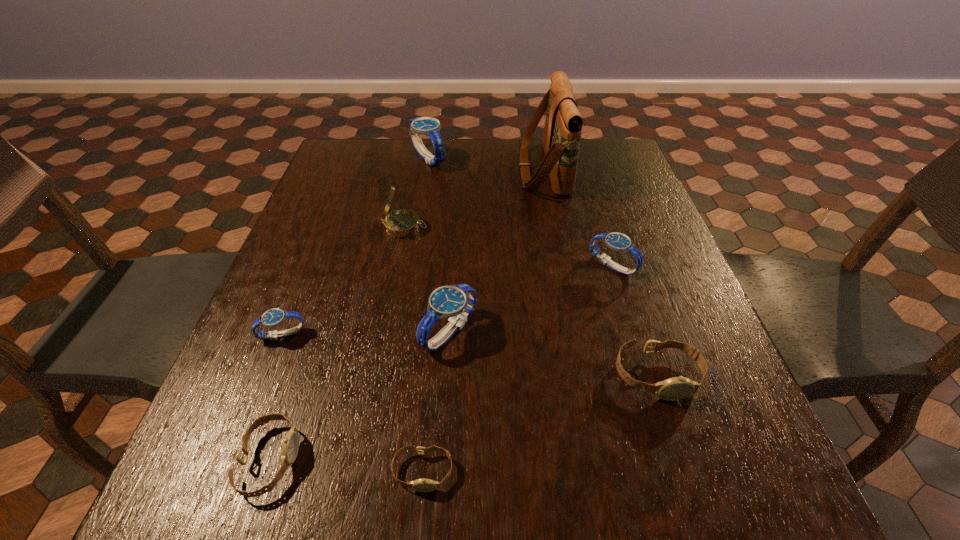
This screenshot has height=540, width=960. Identify the location of the leftmost blue watch. (273, 317).

Identify the location of the leftmost beige watch. (290, 446).

You are a GUI agent. You are given a task and a screenshot of the screen. Output one action in this format:
    pyautogui.click(x=<x>, y=<y>)
    Task: Click on the shortest watch
    This screenshot has width=960, height=540.
    Given the screenshot: What is the action you would take?
    pyautogui.click(x=422, y=485)

At what (x,y) coordinates should I click in order to perform the action: click on the second beige watch from left to right. Please return your answer as a coordinate pair (x, y). Looking at the image, I should click on (422, 485).

The image size is (960, 540). In order to click on vacant space located on the front-facing side of the shoulder bag in this screenshot , I will do `click(477, 169)`.

Where is `free space located on the front-facing side of the shoulder bag`? The height and width of the screenshot is (540, 960). free space located on the front-facing side of the shoulder bag is located at coordinates (381, 169).

Find the location of `blank area located 0.160m on the front-facing side of the shoulder bag`. blank area located 0.160m on the front-facing side of the shoulder bag is located at coordinates (464, 169).

Find the location of a particular element. The image size is (960, 540). free space located on the front of the biggest blue watch is located at coordinates 422,196.

At what (x,y) coordinates should I click in order to perform the action: click on free space located 0.320m with the dial facing the compass. Please return your answer as a coordinate pair (x, y). This screenshot has width=960, height=540. Looking at the image, I should click on (556, 227).

You are a GUI agent. You are given a task and a screenshot of the screen. Output one action in this format:
    pyautogui.click(x=<x>, y=<y>)
    Task: Click on the free location located 0.240m on the back of the third smallest blue watch
    
    Given the screenshot: What is the action you would take?
    pyautogui.click(x=456, y=232)